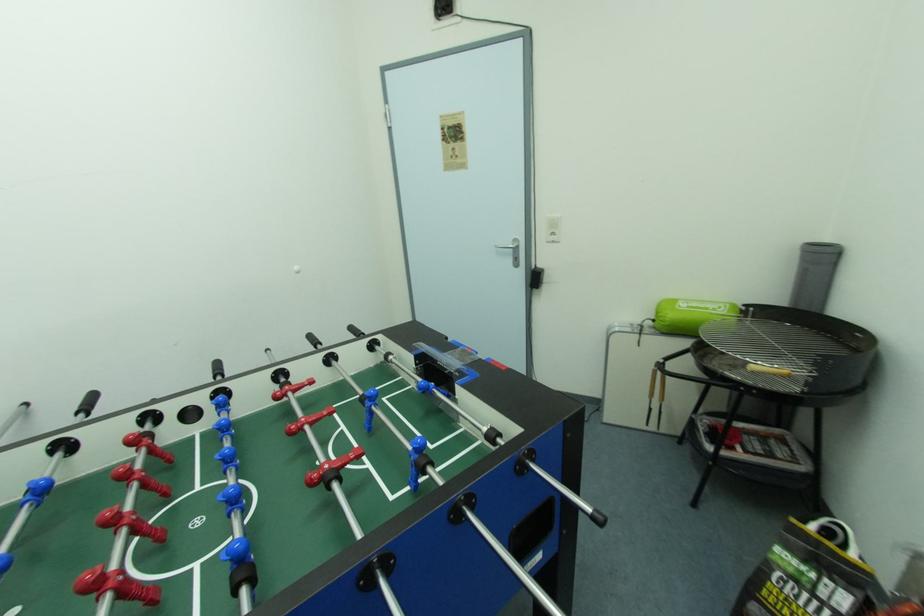
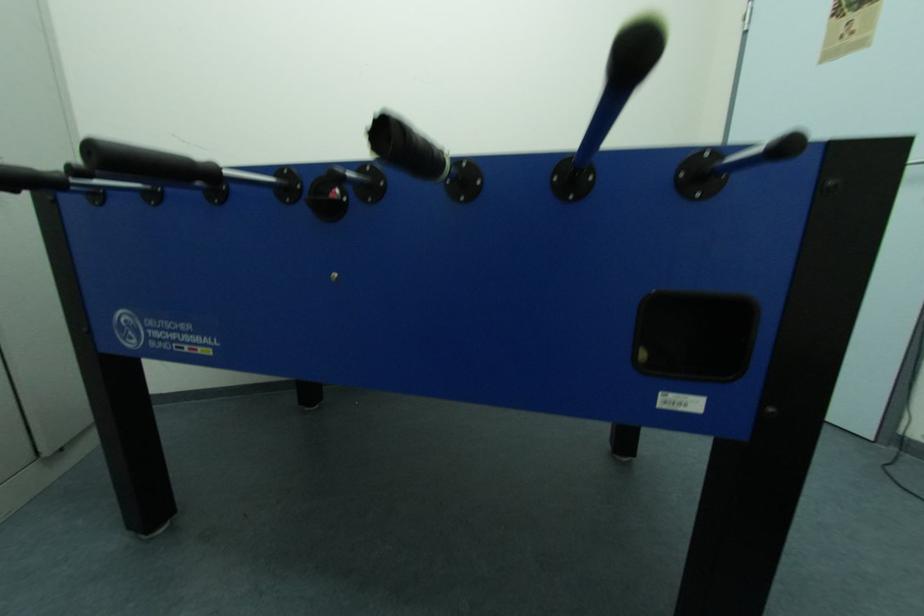
Question: The camera is either moving clockwise (left) or counter-clockwise (right) around the object. The first image is from the beginning of the video and the second image is from the end. Is the camera moving left or right when shooting the video?

Choices:
 (A) Left
 (B) Right

Answer: (B)